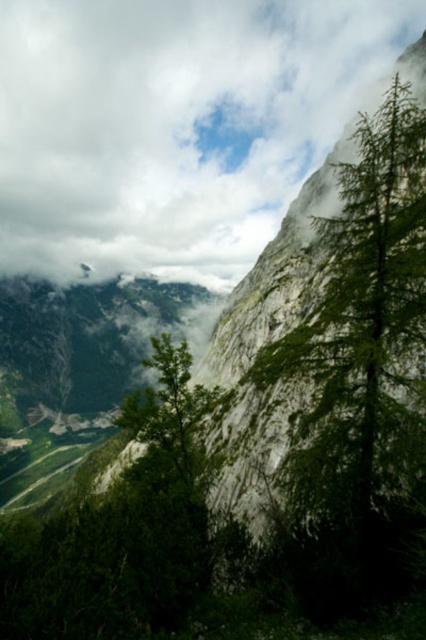
Is white fluffy cloud at upper center further to camera compared to green leafy tree at right?

That is True.

Measure the distance between white fluffy cloud at upper center and green leafy tree at right.

white fluffy cloud at upper center is 290.09 meters from green leafy tree at right.

Who is more forward, (x=284, y=1) or (x=331, y=380)?

Positioned in front is point (x=331, y=380).

The image size is (426, 640). In order to click on white fluffy cloud at upper center in this screenshot , I will do `click(173, 125)`.